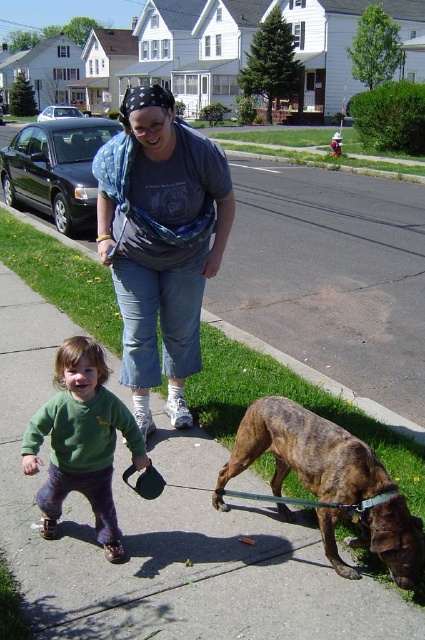
In the scene shown: Please look at the image and locate the point at coordinates (161, 241). What object is located at that point?

The point at coordinates (161, 241) corresponds to the matte gray t shirt at center.

You are a photographer trying to capture a photo of the brindle fur dog at lower right and the green fuzzy sweater at center. If you want to ensure both subjects are fully in frame, which one requires more horizontal space in the camera frame?

The brindle fur dog at lower right might be wider than the green fuzzy sweater at center, so it requires more horizontal space in the camera frame to ensure it is fully captured.